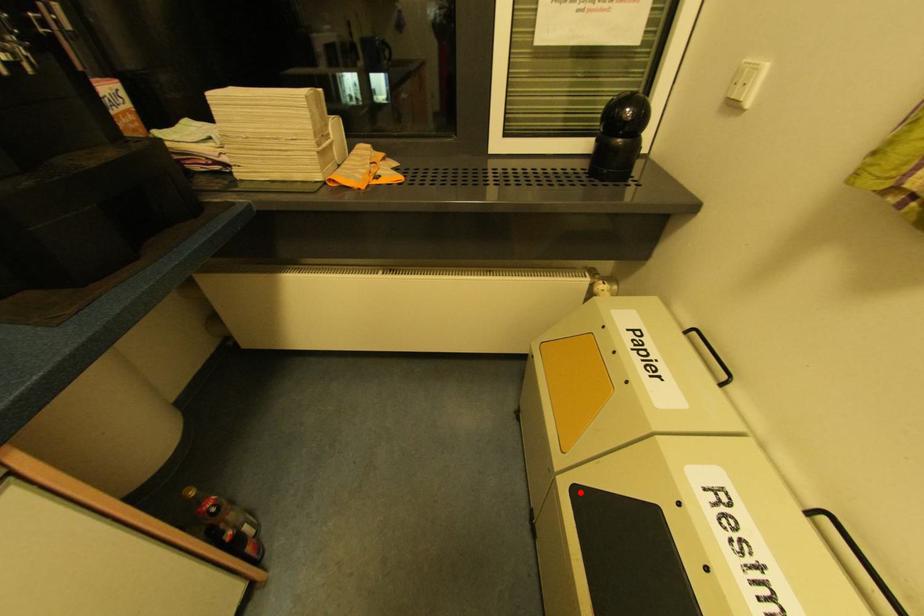
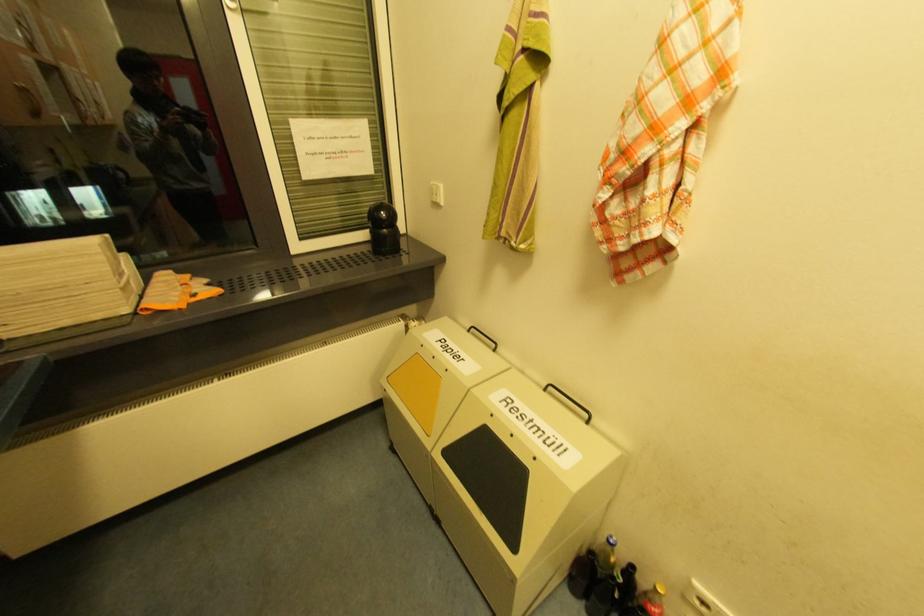
Where in the second image is the point corresponding to the highlighted location from the first image?

(450, 454)